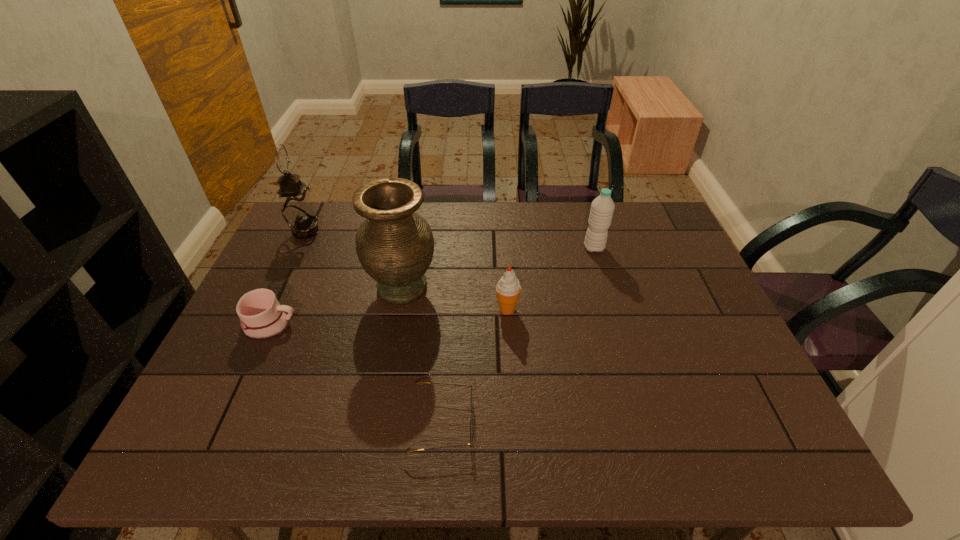
Where is `free space between the mug and the fourth tallest object`? This screenshot has width=960, height=540. free space between the mug and the fourth tallest object is located at coordinates (389, 317).

Locate an element on the screen. vacant space that's between the rightmost object and the second object from right to left is located at coordinates (551, 279).

This screenshot has width=960, height=540. I want to click on vacant area that lies between the water bottle and the vase, so click(498, 267).

The width and height of the screenshot is (960, 540). In order to click on free space between the vase and the mug in this screenshot , I will do `click(336, 306)`.

Where is `vacant area that lies between the oil lamp and the vase`? The height and width of the screenshot is (540, 960). vacant area that lies between the oil lamp and the vase is located at coordinates (354, 260).

Find the location of a particular element. object that stands as the second closest to the oil lamp is located at coordinates (x=261, y=316).

You are a GUI agent. You are given a task and a screenshot of the screen. Output one action in this format:
    pyautogui.click(x=<x>, y=<y>)
    Task: Click on the object identified as the closest to the shortest object
    
    Given the screenshot: What is the action you would take?
    [508, 288]

Find the location of `vacant space that satisfies the following two spatial constraints: 1. on the front side of the fifth object from left to right; 2. on the left side of the oil lamp`. vacant space that satisfies the following two spatial constraints: 1. on the front side of the fifth object from left to right; 2. on the left side of the oil lamp is located at coordinates (269, 309).

Identify the location of free location that satisfies the following two spatial constraints: 1. on the front side of the fourth tallest object; 2. on the right side of the oil lamp. (269, 309).

Find the location of `vacant space that satisfies the following two spatial constraints: 1. on the front side of the oil lamp; 2. on the left side of the fourth shortest object`. vacant space that satisfies the following two spatial constraints: 1. on the front side of the oil lamp; 2. on the left side of the fourth shortest object is located at coordinates (298, 248).